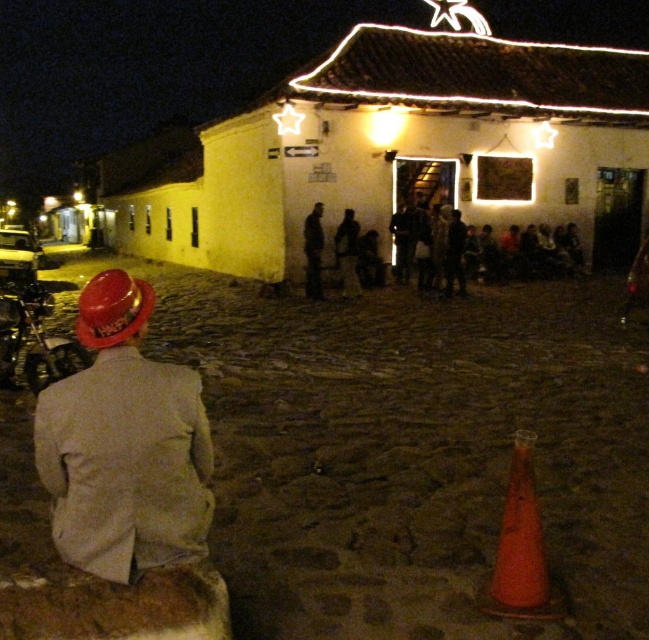
You are a delivery person who needs to park your motorcycle in the town square but must keep it at least 10 meters away from the dark gray fabric at center. Can you park your shiny chrome motorcycle at lower left without violating this rule?

The distance between the shiny chrome motorcycle at lower left and the dark gray fabric at center is 8.10 meters, which is less than the required 10 meters. Therefore, parking the shiny chrome motorcycle at lower left would violate the rule.

You are standing in the town square and want to place a small potted plant between the matte red hat at lower left and the shiny chrome motorcycle at lower left. Can you estimate if there is enough space between them to fit the plant?

The matte red hat at lower left might be wider than shiny chrome motorcycle at lower left, so there might be sufficient space to place the small potted plant between them.

You are standing in the town square and want to reach the point marked at coordinates point (528,593). If you can walk 12 feet per minute, how many minutes will it take you to reach that point?

The distance between you and point (528,593) is 11.38 feet. At a walking speed of 12 feet per minute, it would take approximately 0.95 minutes to reach the point.